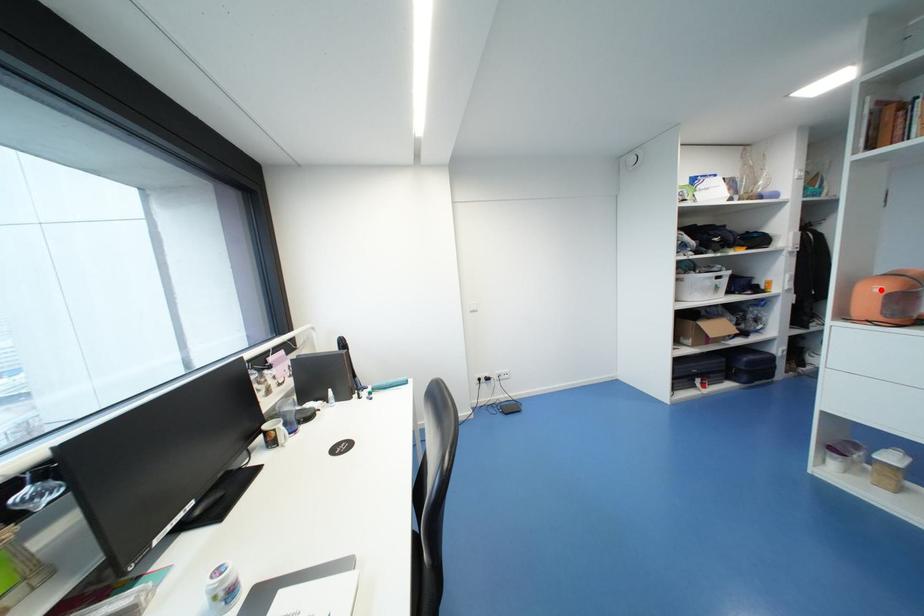
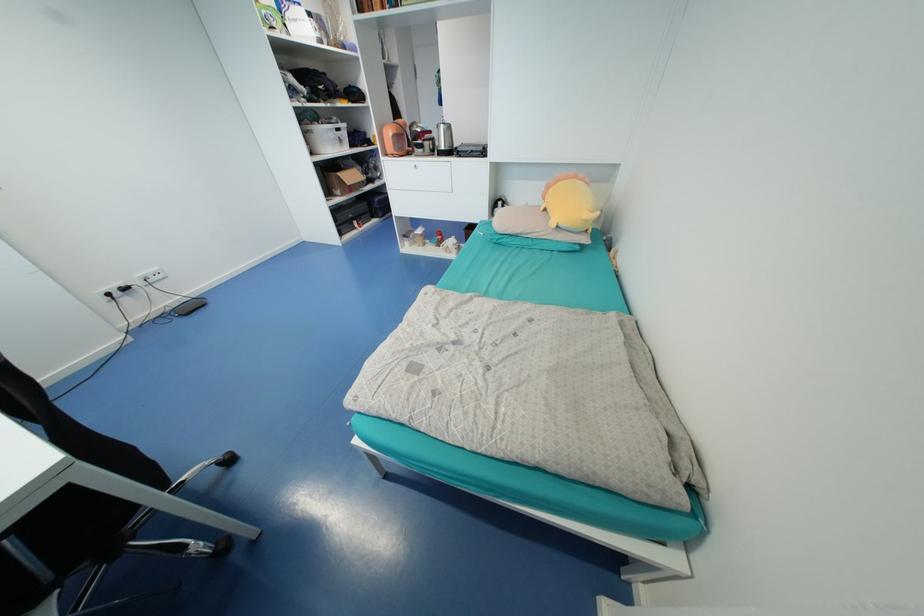
Question: I am providing you with two images of the same scene from different viewpoints. A red point is marked on the first image. Is the red point's position out of view in image 2?

Choices:
 (A) Yes
 (B) No

Answer: (B)